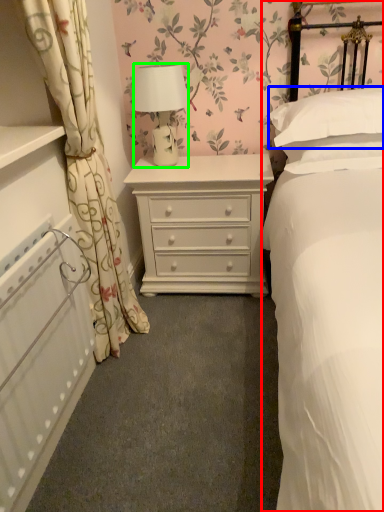
Question: Which is nearer to the bed (highlighted by a red box)? pillow (highlighted by a blue box) or lamp (highlighted by a green box).

Choices:
 (A) pillow
 (B) lamp

Answer: (A)